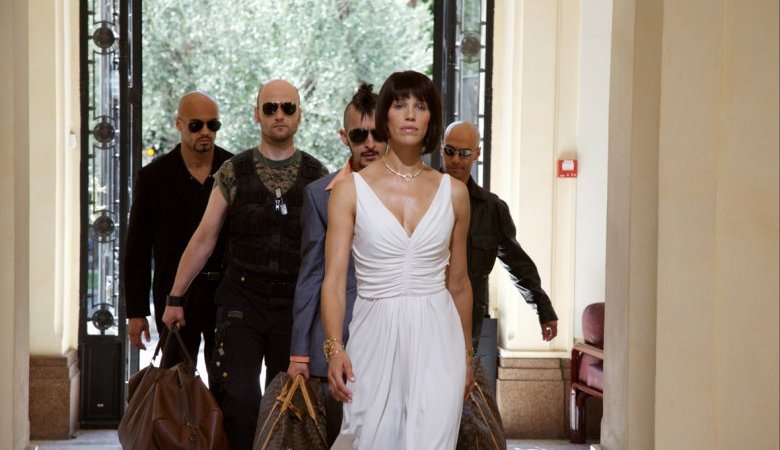
Where is `chair`? chair is located at coordinates (594, 332).